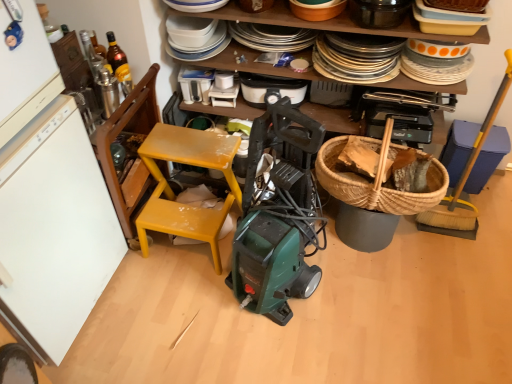
The height and width of the screenshot is (384, 512). What are the coordinates of `vacant area that lies in front of yellow plastic broom at right, which is the sixth appliance from left to right` in the screenshot? It's located at (464, 245).